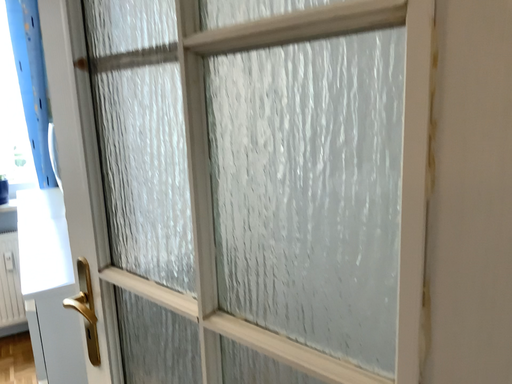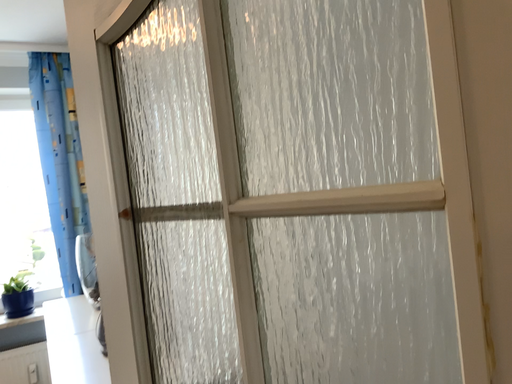
Question: How did the camera likely rotate when shooting the video?

Choices:
 (A) rotated upward
 (B) rotated downward

Answer: (A)